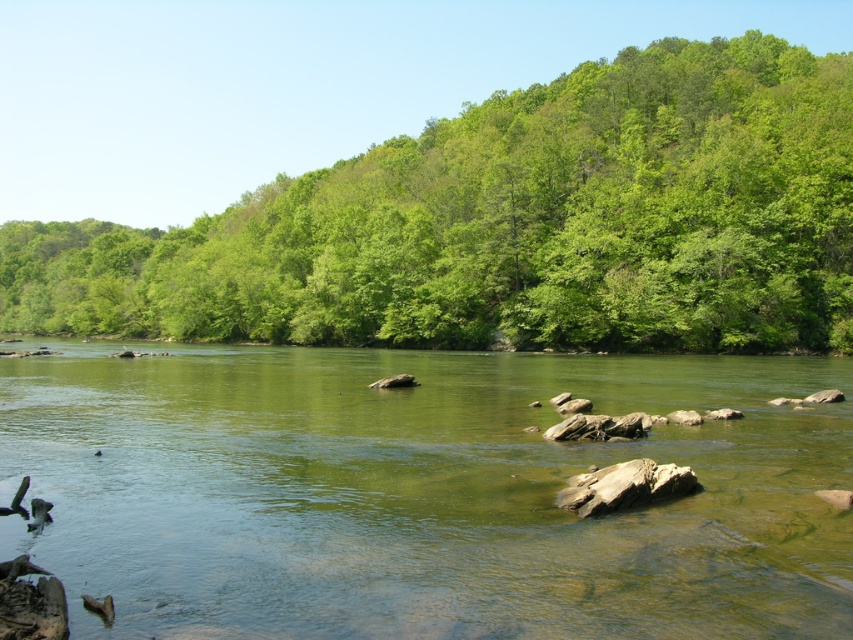
Is green translucent water at center above green leafy trees at upper center?

No, green translucent water at center is not above green leafy trees at upper center.

Measure the distance between point (129, 515) and camera.

The distance of point (129, 515) from camera is 11.38 meters.

Find the location of a particular element. green translucent water at center is located at coordinates (422, 493).